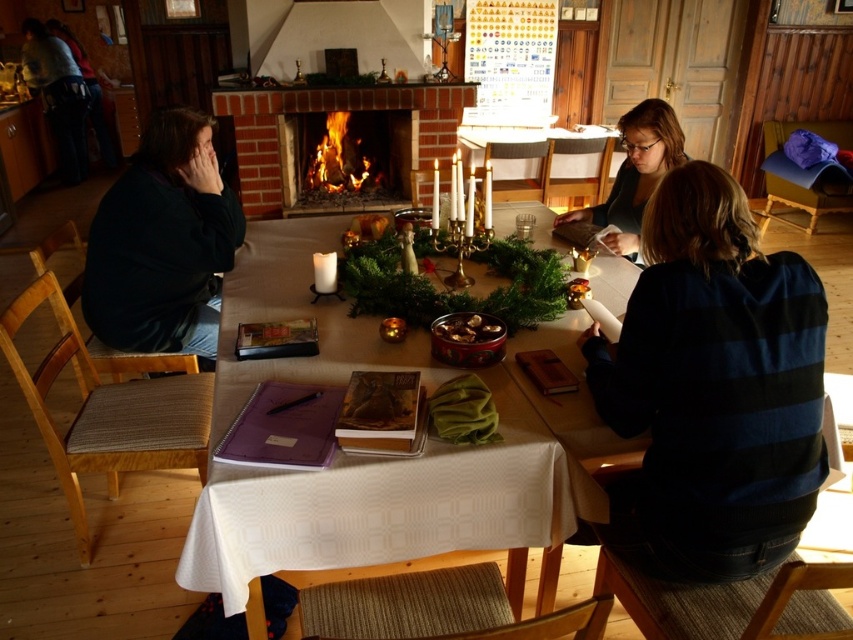
From the picture: Does brick fireplace at center come in front of shiny metallic bowl at center?

That is False.

Who is shorter, brick fireplace at center or shiny metallic bowl at center?

shiny metallic bowl at center

Is point (260, 184) positioned in front of point (456, 320)?

No.

Where is `brick fireplace at center`? This screenshot has height=640, width=853. brick fireplace at center is located at coordinates (328, 112).

Is dark matte jacket at left taller than matte black sweater at center?

Yes, dark matte jacket at left is taller than matte black sweater at center.

Who is higher up, dark matte jacket at left or matte black sweater at center?

matte black sweater at center is higher up.

What do you see at coordinates (161, 243) in the screenshot? I see `dark matte jacket at left` at bounding box center [161, 243].

Identify the location of dark matte jacket at left. (161, 243).

Is dark blue striped sweater at lower right bigger than matte black sweater at center?

Yes, dark blue striped sweater at lower right is bigger than matte black sweater at center.

How far apart are dark blue striped sweater at lower right and matte black sweater at center?

3.52 feet

Identify the location of dark blue striped sweater at lower right. This screenshot has height=640, width=853. (712, 388).

Where is `dark blue striped sweater at lower right`? dark blue striped sweater at lower right is located at coordinates (712, 388).